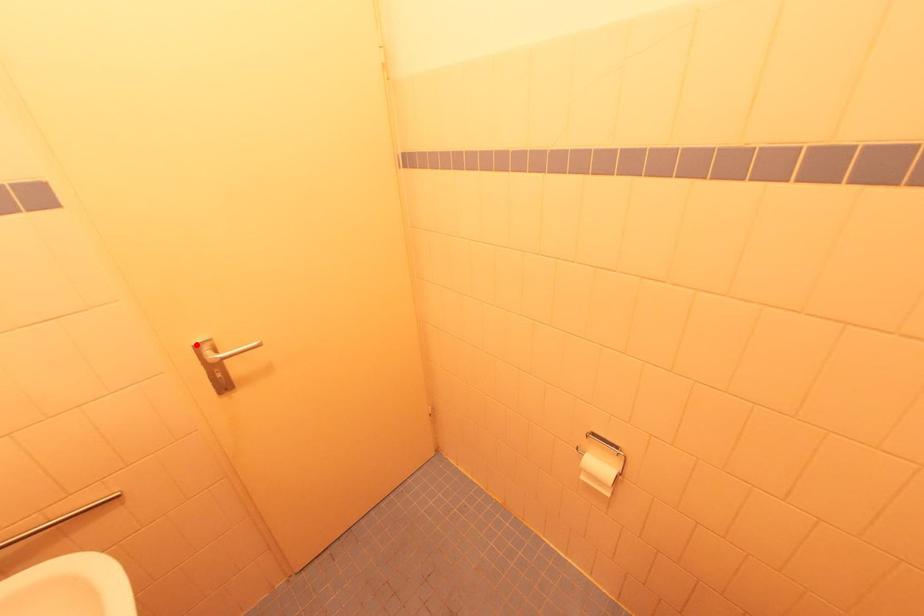
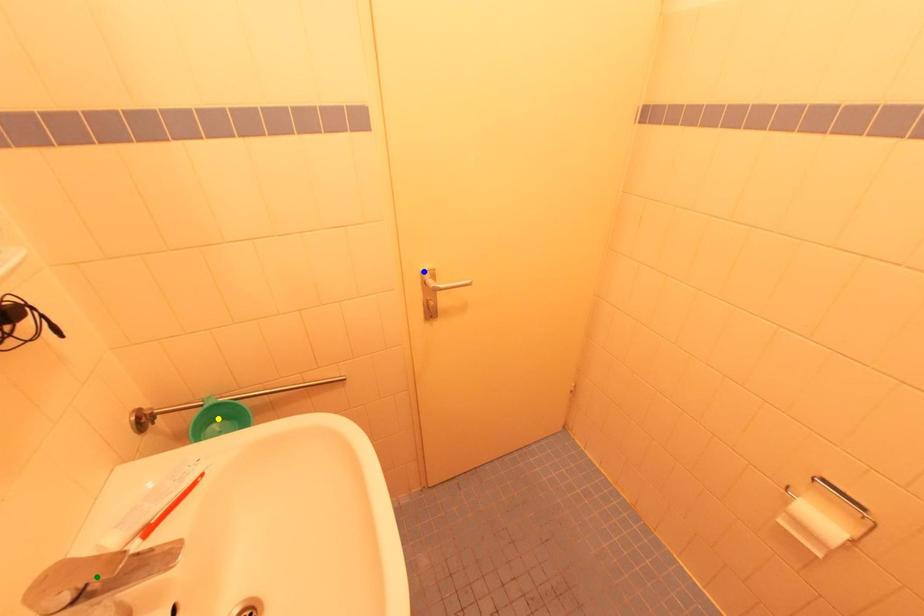
Question: I am providing you with two images of the same scene from different viewpoints. A red point is marked on the first image. You are given multiple points on the second image. Can you choose the point in image 2 that corresponds to the point in image 1?

Choices:
 (A) yellow point
 (B) green point
 (C) blue point

Answer: (C)